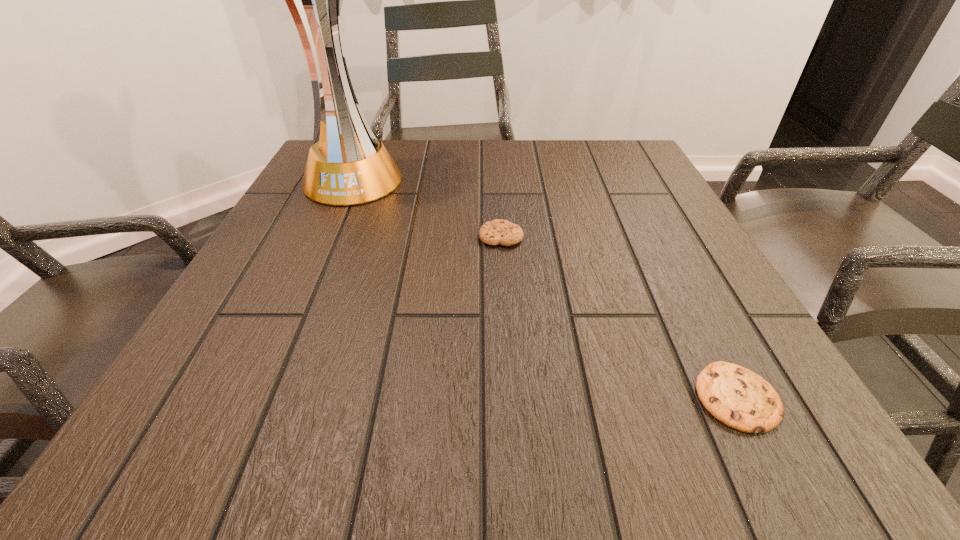
This screenshot has width=960, height=540. Identify the location of object at the near edge. (734, 395).

Identify the location of object located in the left edge section of the desktop. pyautogui.click(x=353, y=168).

The image size is (960, 540). I want to click on object that is at the right edge, so click(x=734, y=395).

Find the location of a particular element. object that is at the far left corner is located at coordinates (353, 168).

You are a GUI agent. You are given a task and a screenshot of the screen. Output one action in this format:
    pyautogui.click(x=<x>, y=<y>)
    Task: Click on the object at the near right corner
    The height and width of the screenshot is (540, 960).
    Given the screenshot: What is the action you would take?
    pyautogui.click(x=734, y=395)

In the image, there is a desktop. What are the coordinates of `free space at the far edge` in the screenshot? It's located at (524, 162).

In the image, there is a desktop. Where is `vacant space at the near edge`? This screenshot has width=960, height=540. vacant space at the near edge is located at coordinates (403, 400).

Locate an element on the screen. This screenshot has width=960, height=540. vacant space at the left edge of the desktop is located at coordinates (293, 224).

The width and height of the screenshot is (960, 540). Identify the location of free space at the right edge. (632, 284).

You are a GUI agent. You are given a task and a screenshot of the screen. Output one action in this format:
    pyautogui.click(x=<x>, y=<y>)
    Task: Click on the vacant space at the far right corner of the desktop
    
    Given the screenshot: What is the action you would take?
    pos(652,180)